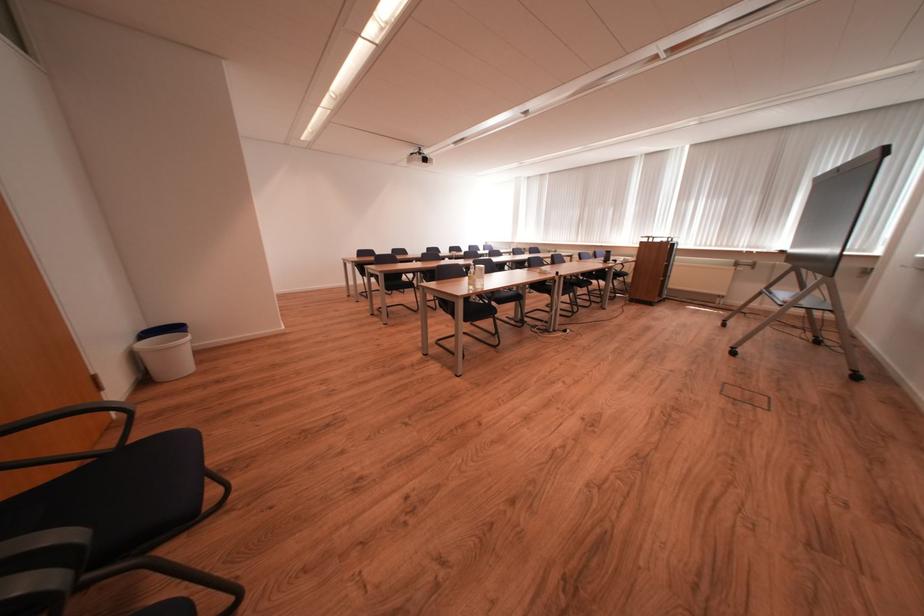
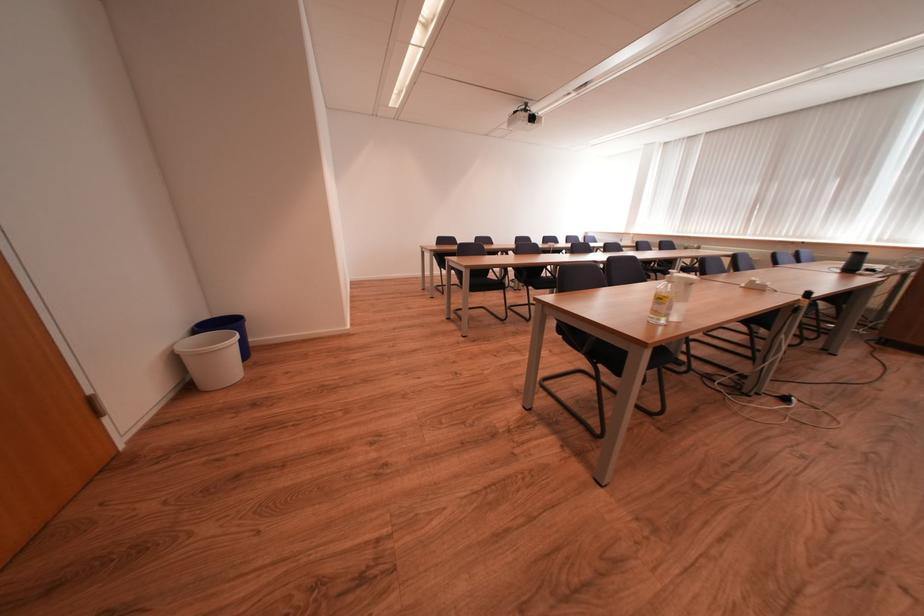
Find the pixel in the second image that matches point 156,336 in the first image.

(213, 329)